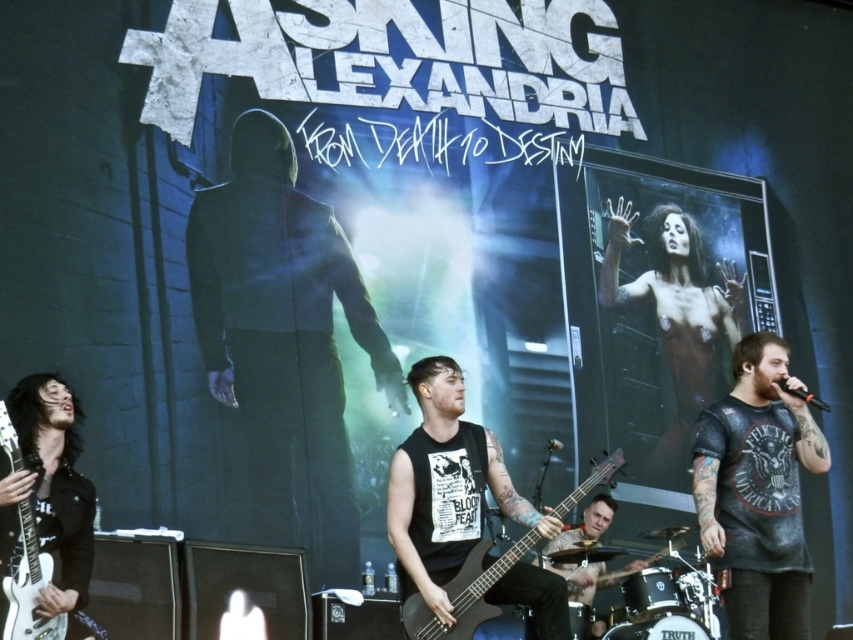
The image size is (853, 640). Describe the element at coordinates (465, 593) in the screenshot. I see `black matte bass guitar at center` at that location.

Who is positioned more to the left, black matte bass guitar at center or white glossy electric guitar at left?

From the viewer's perspective, white glossy electric guitar at left appears more on the left side.

Locate an element on the screen. black matte bass guitar at center is located at coordinates (465, 593).

I want to click on black matte bass guitar at center, so click(465, 593).

Does point (808, 419) lie behind point (418, 600)?

Yes, point (808, 419) is farther from viewer.

Can you confirm if dark gray t-shirt at center is positioned below black matte bass guitar at center?

No.

Which is behind, point (798, 458) or point (608, 456)?

The point (608, 456) is more distant.

Image resolution: width=853 pixels, height=640 pixels. Identify the location of dark gray t-shirt at center. (757, 492).

From the picture: Between dark matte hoodie at center and black matte bass guitar at center, which one appears on the left side from the viewer's perspective?

dark matte hoodie at center is more to the left.

Which of these two, dark matte hoodie at center or black matte bass guitar at center, stands taller?

Standing taller between the two is dark matte hoodie at center.

Between point (213, 364) and point (490, 577), which one is positioned in front?

Point (490, 577) is in front.

Image resolution: width=853 pixels, height=640 pixels. Identify the location of dark matte hoodie at center. (283, 342).